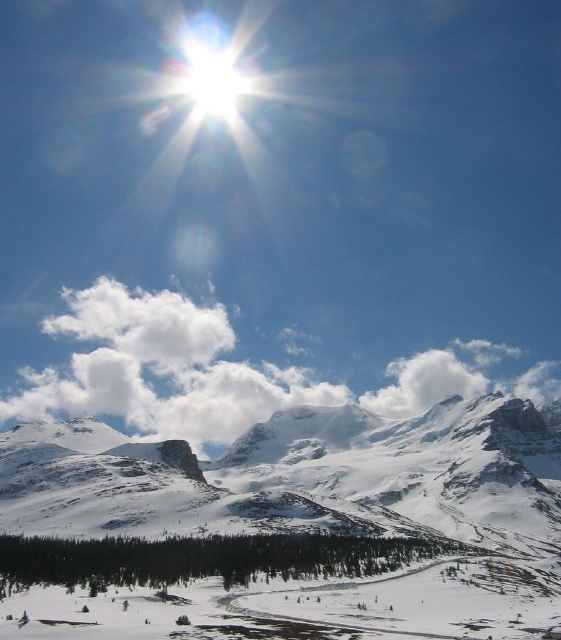
Question: Can you confirm if bright white snow at upper center is wider than white fluffy cloud at center?

Choices:
 (A) yes
 (B) no

Answer: (A)

Question: Does snowy granite mountain at center appear under white fluffy cloud at center?

Choices:
 (A) no
 (B) yes

Answer: (B)

Question: Estimate the real-world distances between objects in this image. Which object is farther from the white fluffy cloud at center?

Choices:
 (A) snowy granite mountain at center
 (B) bright white snow at upper center

Answer: (A)

Question: Which object appears farthest from the camera in this image?

Choices:
 (A) bright white snow at upper center
 (B) white fluffy cloud at upper left
 (C) snowy granite mountain at center

Answer: (B)

Question: Is bright white snow at upper center to the right of white fluffy cloud at upper left from the viewer's perspective?

Choices:
 (A) no
 (B) yes

Answer: (B)

Question: Which of the following is the farthest from the observer?

Choices:
 (A) white fluffy cloud at center
 (B) snowy granite mountain at center
 (C) bright white snow at upper center
 (D) white fluffy cloud at upper left

Answer: (D)